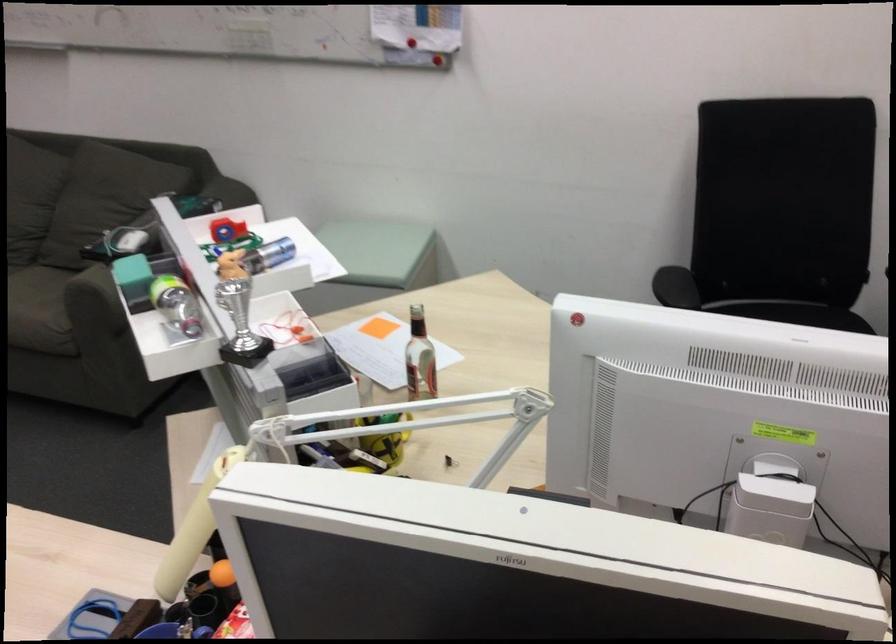
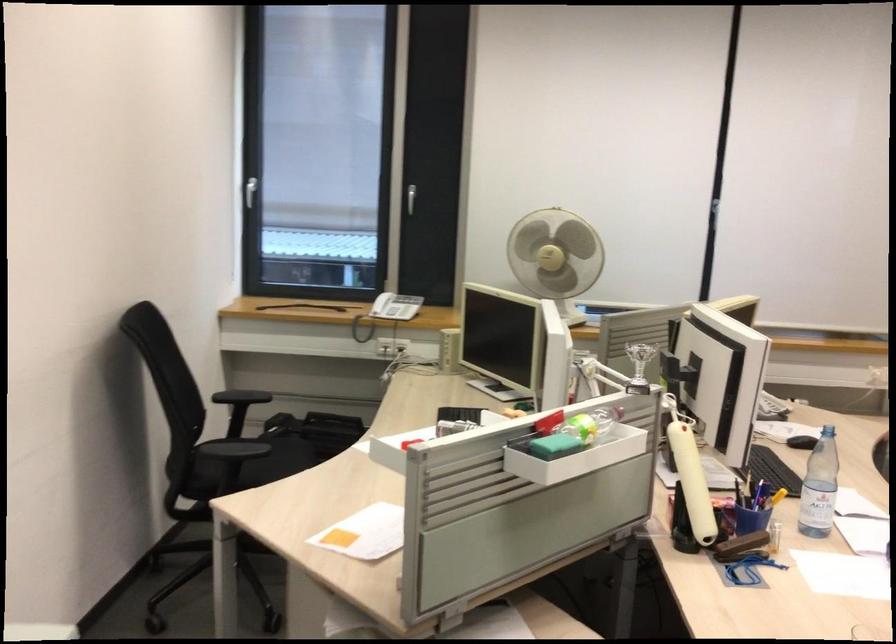
Question: I am providing you with two images of the same scene from different viewpoints. Please identify which objects are invisible in image2.

Choices:
 (A) glass bottle
 (B) white disposable cup
 (C) white window handle
 (D) telephone handset

Answer: (A)